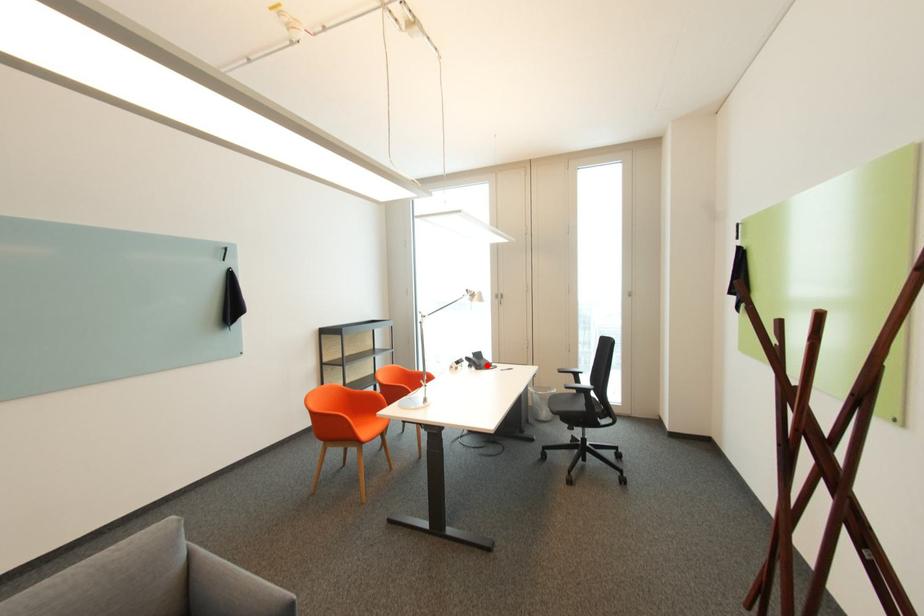
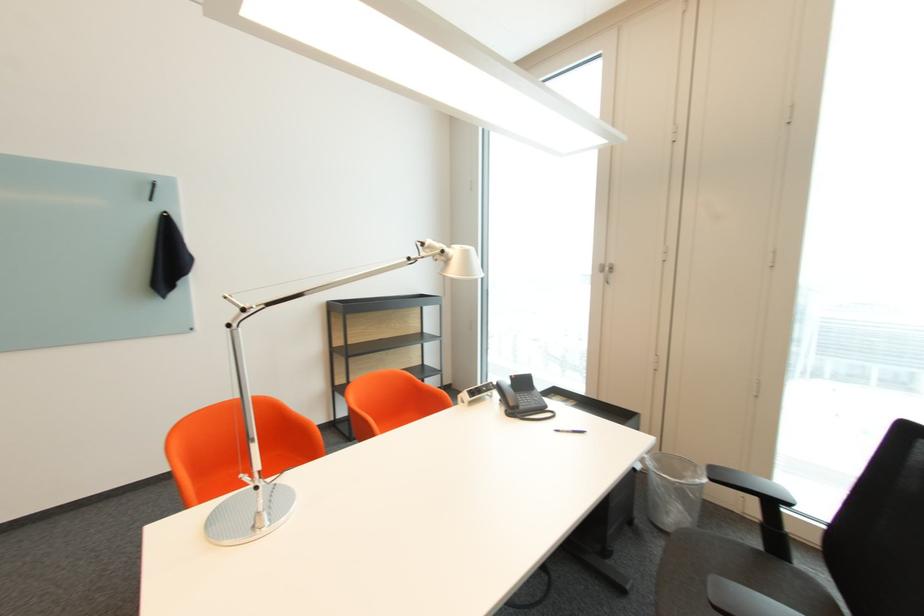
In the second image, find the point that corresponds to the highlighted location in the first image.

(524, 407)